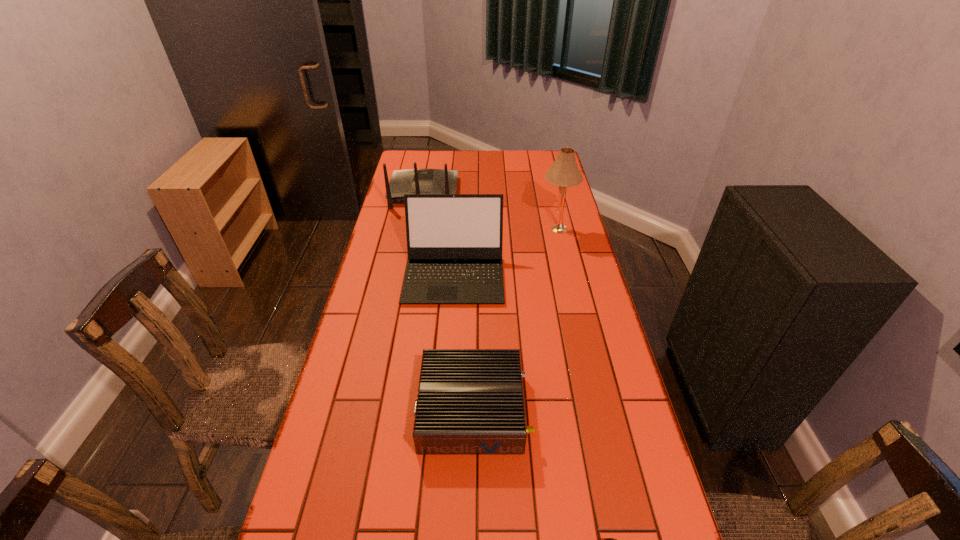
Identify the location of free point located on the front-facing side of the farther router. (430, 156).

Where is `free space located on the front-facing side of the farther router`? free space located on the front-facing side of the farther router is located at coordinates (430, 159).

Locate an element on the screen. The image size is (960, 540). free space located 0.080m on the back panel of the fourth tallest object is located at coordinates (561, 409).

Where is `laptop located at the left edge`? This screenshot has height=540, width=960. laptop located at the left edge is located at coordinates (454, 241).

Image resolution: width=960 pixels, height=540 pixels. In order to click on router that is at the left edge in this screenshot , I will do `click(410, 181)`.

This screenshot has width=960, height=540. What are the coordinates of `object at the right edge` in the screenshot? It's located at (564, 172).

This screenshot has width=960, height=540. In the image, there is a desktop. What are the coordinates of `vacant space at the left edge` in the screenshot? It's located at (346, 404).

The height and width of the screenshot is (540, 960). Find the location of `free space at the right edge of the desktop`. free space at the right edge of the desktop is located at coordinates (564, 379).

The height and width of the screenshot is (540, 960). Identify the location of vacant region at the far right corner. (556, 154).

At what (x,y) coordinates should I click in order to perform the action: click on vacant space that's between the third farthest object and the nearer router. Please return your answer as a coordinate pair (x, y). Looking at the image, I should click on (464, 342).